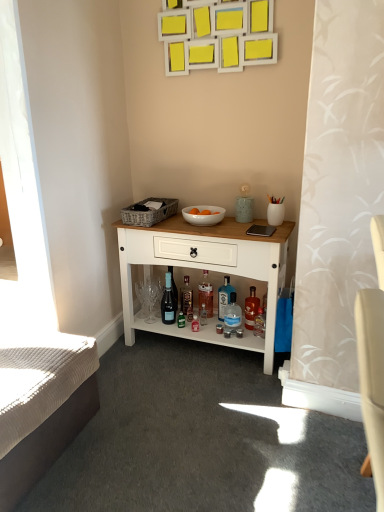
The height and width of the screenshot is (512, 384). I want to click on free space to the left of white glossy bowl at center, so click(x=168, y=220).